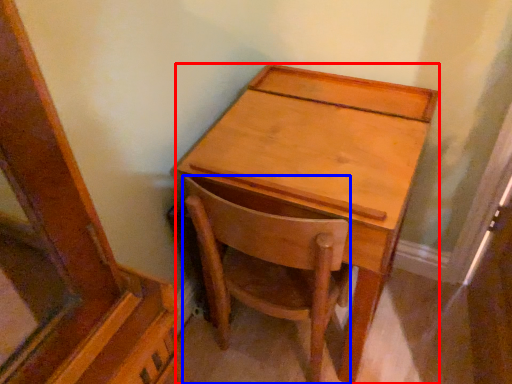
Question: Which object is further to the camera taking this photo, desk (highlighted by a red box) or chair (highlighted by a blue box)?

Choices:
 (A) desk
 (B) chair

Answer: (B)